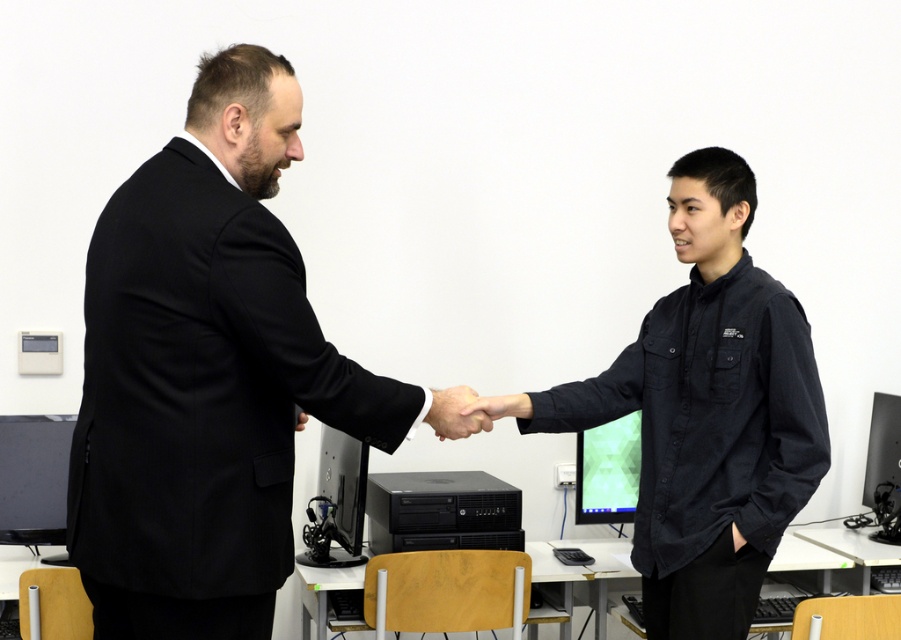
Which is more to the right, black matte shirt at right or matte black hand at center?

From the viewer's perspective, black matte shirt at right appears more on the right side.

Describe the element at coordinates (706, 412) in the screenshot. This screenshot has width=901, height=640. I see `black matte shirt at right` at that location.

Does point (763, 276) come in front of point (440, 403)?

No, (763, 276) is behind (440, 403).

Where is `black matte shirt at right`? black matte shirt at right is located at coordinates (706, 412).

Describe the element at coordinates (441, 512) in the screenshot. The image size is (901, 640). I see `black plastic computer tower at center` at that location.

Is point (485, 520) positioned before point (599, 496)?

Yes.

Does point (406, 525) lie in front of point (607, 438)?

Yes, point (406, 525) is in front of point (607, 438).

Locate an element on the screen. This screenshot has width=901, height=640. black plastic computer tower at center is located at coordinates (441, 512).

Who is more forward, (315, 506) or (604, 445)?

Point (604, 445) is in front.

What do you see at coordinates (335, 500) in the screenshot?
I see `matte black monitor at center` at bounding box center [335, 500].

Image resolution: width=901 pixels, height=640 pixels. What are the coordinates of `matte black monitor at center` in the screenshot? It's located at (335, 500).